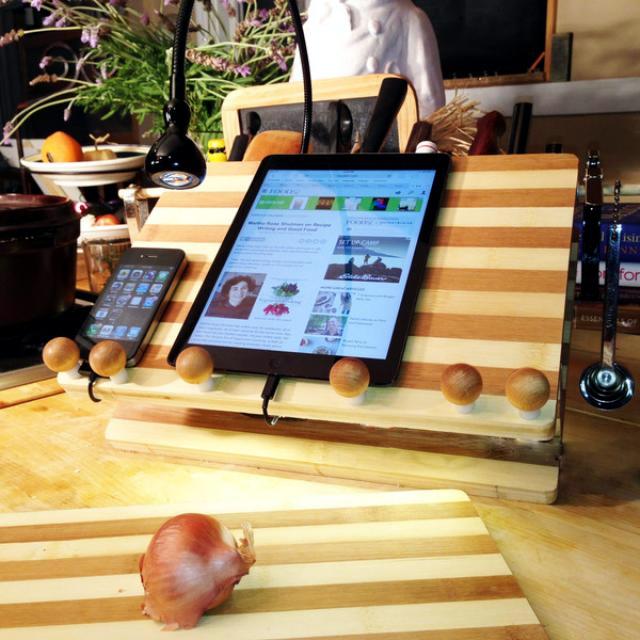
Where is `phone`? This screenshot has width=640, height=640. phone is located at coordinates (120, 317).